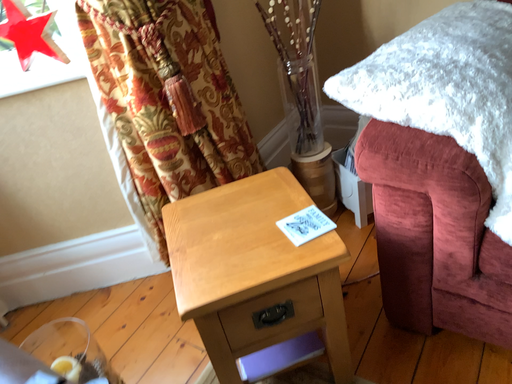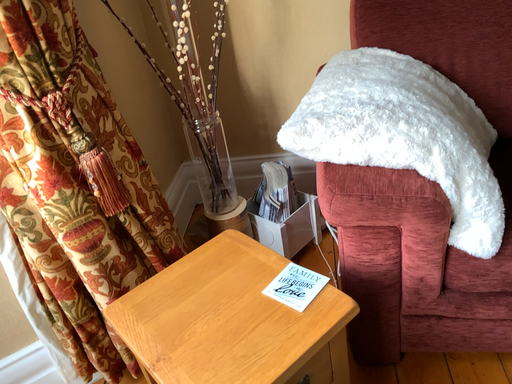
Question: How did the camera likely rotate when shooting the video?

Choices:
 (A) rotated left
 (B) rotated right

Answer: (B)